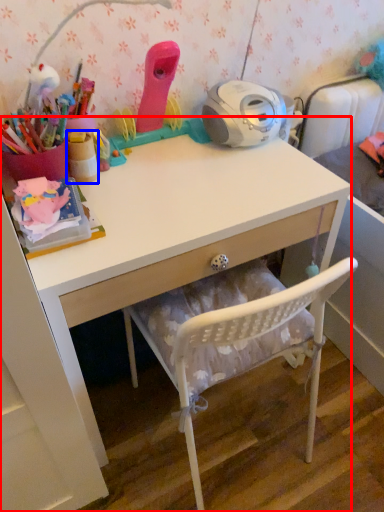
Question: Which point is further to the camera, desk (highlighted by a red box) or stationery (highlighted by a blue box)?

Choices:
 (A) desk
 (B) stationery

Answer: (B)